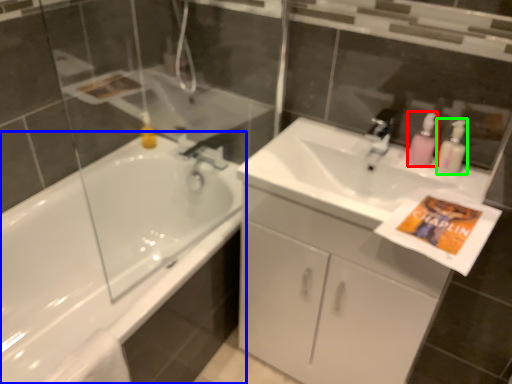
Question: Which is nearer to the soap dispenser (highlighted by a red box)? bathtub (highlighted by a blue box) or cleaning product (highlighted by a green box).

Choices:
 (A) bathtub
 (B) cleaning product

Answer: (B)